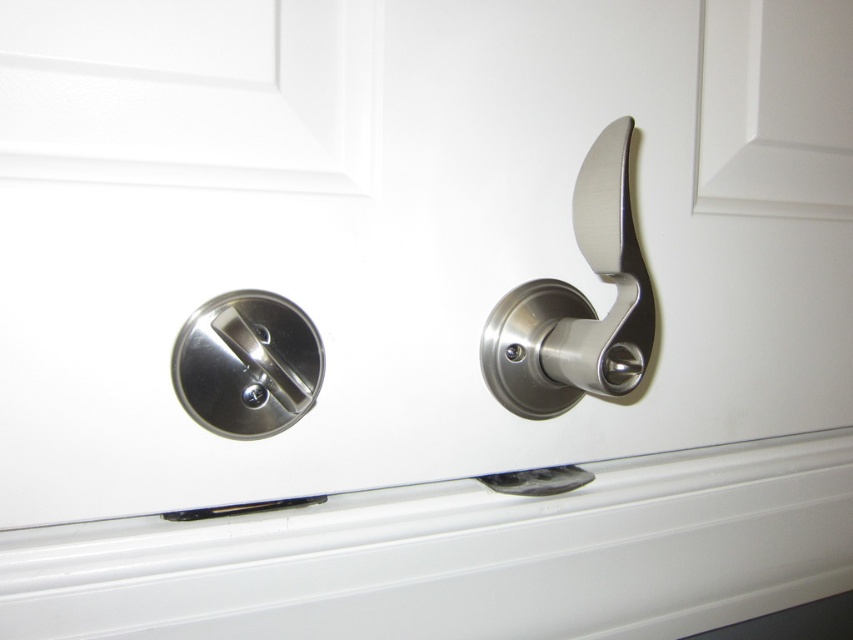
Question: Can you confirm if satin nickel lever at right is smaller than satin nickel lock at center?

Choices:
 (A) yes
 (B) no

Answer: (B)

Question: Is satin nickel lever at right positioned at the back of satin nickel lock at center?

Choices:
 (A) no
 (B) yes

Answer: (B)

Question: Which point is closer to the camera?

Choices:
 (A) satin nickel lock at center
 (B) satin nickel lever at right

Answer: (A)

Question: Is satin nickel lever at right positioned in front of satin nickel lock at center?

Choices:
 (A) no
 (B) yes

Answer: (A)

Question: Among these objects, which one is nearest to the camera?

Choices:
 (A) satin nickel lock at center
 (B) satin nickel lever at right

Answer: (A)

Question: Which point is farther to the camera?

Choices:
 (A) (502, 356)
 (B) (236, 308)

Answer: (A)